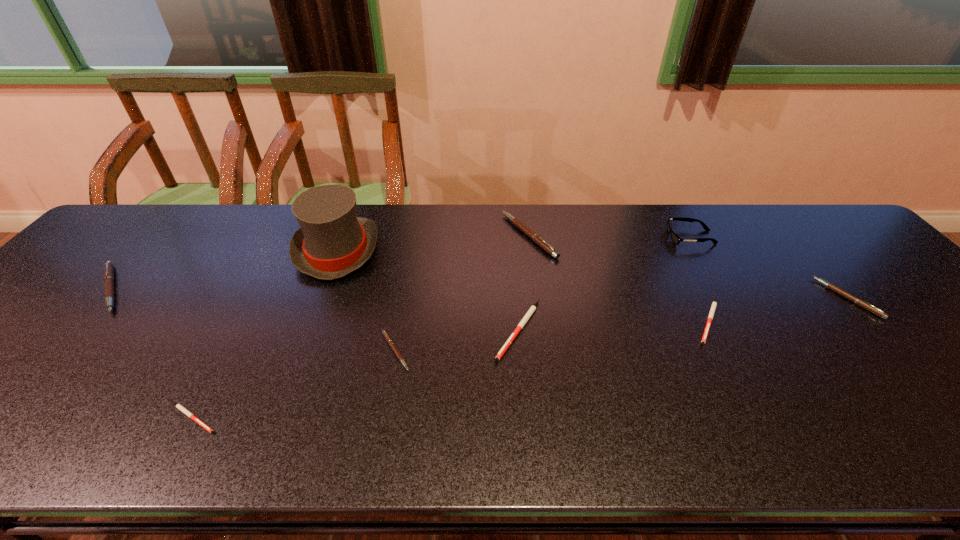
The image size is (960, 540). I want to click on free location located on the clicker of the second pen from right to left, so click(771, 441).

This screenshot has width=960, height=540. I want to click on vacant space situated 0.130m on the clicker of the nearest white pen, so click(288, 418).

This screenshot has height=540, width=960. I want to click on dress hat at the far edge, so click(x=332, y=242).

You are a GUI agent. You are given a task and a screenshot of the screen. Output one action in this format:
    pyautogui.click(x=<x>, y=<y>)
    Task: Click on the sunglasses located in the far edge section of the desktop
    The height and width of the screenshot is (540, 960).
    Given the screenshot: What is the action you would take?
    pyautogui.click(x=676, y=239)

What are the coordinates of `pen present at the far edge` in the screenshot? It's located at tap(534, 237).

Locate an element on the screen. object at the near edge is located at coordinates (181, 408).

Find the location of a particular element. Image resolution: width=960 pixels, height=540 pixels. object present at the left edge is located at coordinates (108, 269).

Locate an element on the screen. The image size is (960, 540). object located in the right edge section of the desktop is located at coordinates (858, 301).

In order to click on vacant space at the far edge in this screenshot , I will do `click(789, 231)`.

Where is `free space at the near edge of the desktop`? free space at the near edge of the desktop is located at coordinates (668, 426).